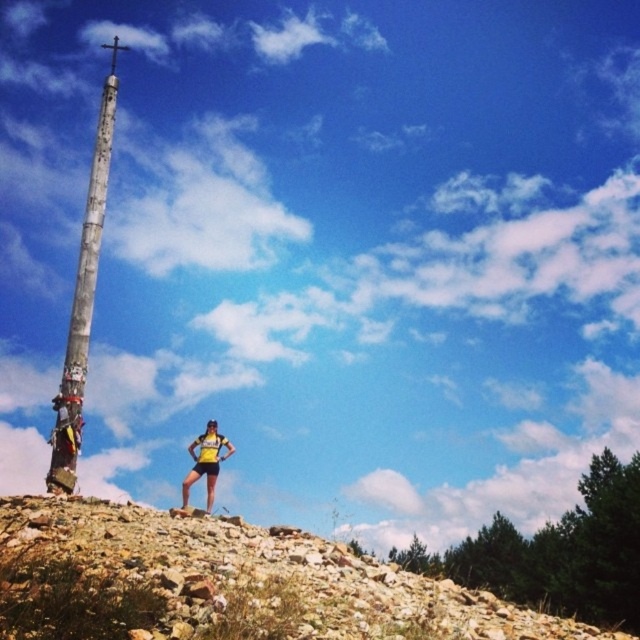
You are a hiker trying to reach the weathered wooden pole at left from the brown rocky hillside at lower left. Based on the scene description, which direction should you move to get to the pole?

The brown rocky hillside at lower left is located below the weathered wooden pole at left, so you should move upward from the brown rocky hillside at lower left to reach the weathered wooden pole at left.

You are a hiker planning to climb the brown rocky hillside at lower left. You are currently standing at the base of the hillside, which is at the same level as the yellow fabric shorts at center. How does the height of the hillside compare to your current position?

The brown rocky hillside at lower left has a greater height compared to the yellow fabric shorts at center, so the hillside is taller than your current position.